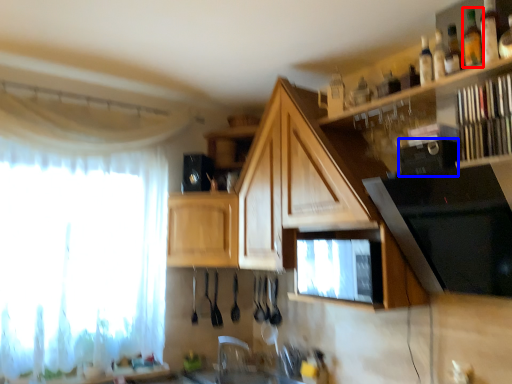
Question: Among these objects, which one is nearest to the camera, bottle (highlighted by a red box) or appliance (highlighted by a blue box)?

Choices:
 (A) bottle
 (B) appliance

Answer: (B)